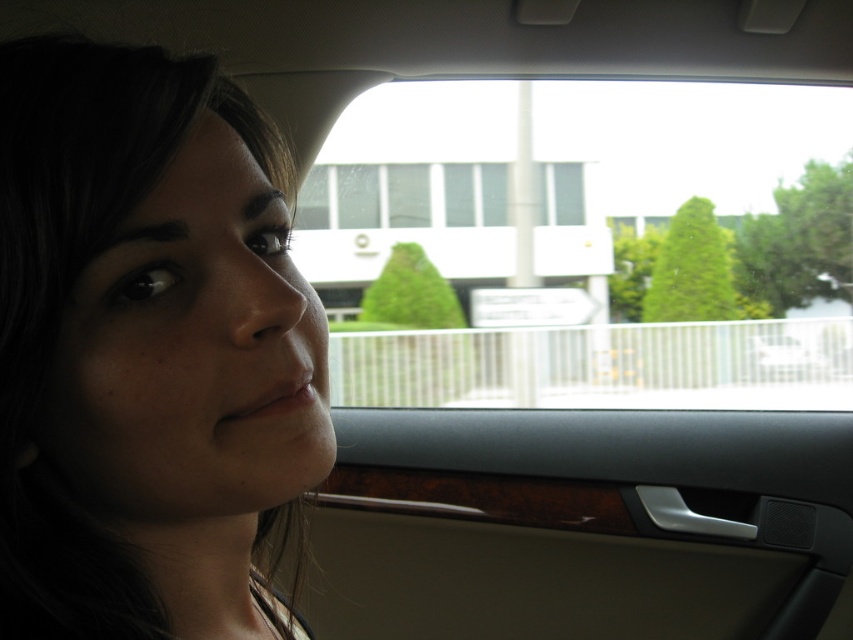
Is matte skin at center thinner than transparent glass at upper center?

Indeed, matte skin at center has a lesser width compared to transparent glass at upper center.

Which is more to the right, matte skin at center or transparent glass at upper center?

Positioned to the right is transparent glass at upper center.

Which is in front, point (250, 481) or point (352, 269)?

Point (250, 481)

Image resolution: width=853 pixels, height=640 pixels. I want to click on matte skin at center, so click(x=148, y=348).